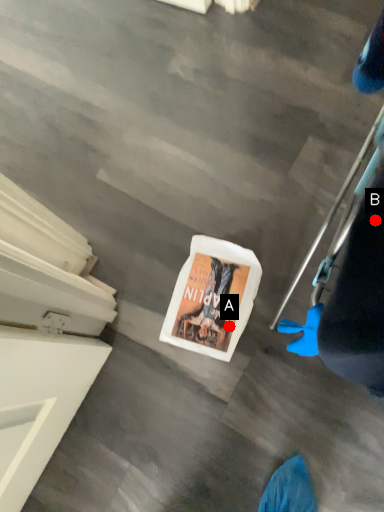
Question: Two points are circled on the image, labeled by A and B beside each circle. Among these points, which one is nearest to the camera?

Choices:
 (A) A is closer
 (B) B is closer

Answer: (B)